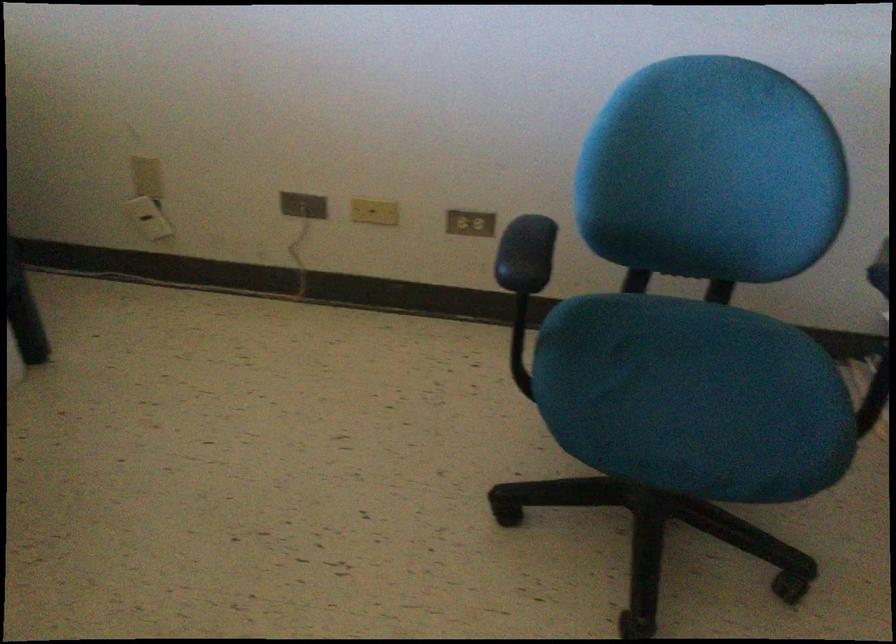
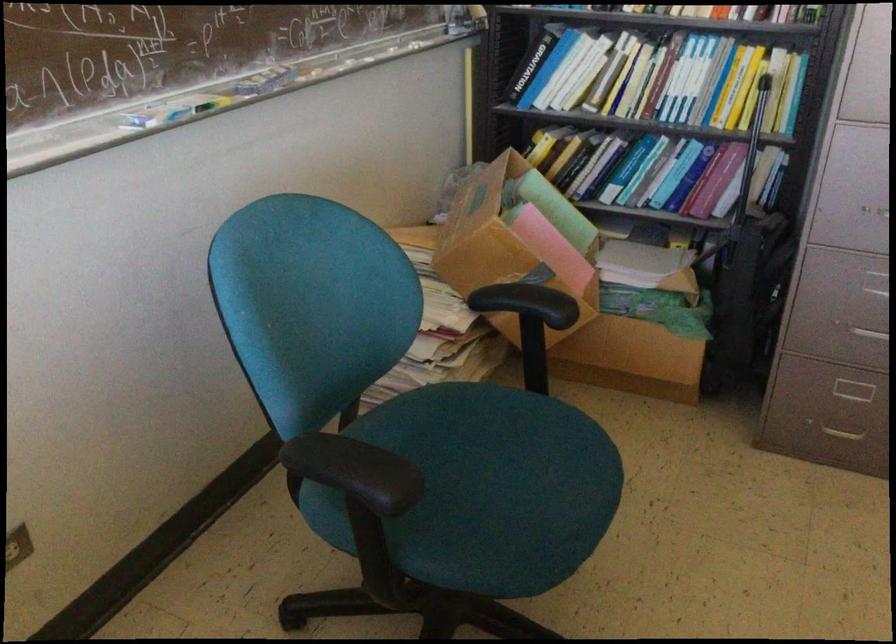
Locate, in the second image, the point that corresponds to the point at 522,242 in the first image.

(356, 471)